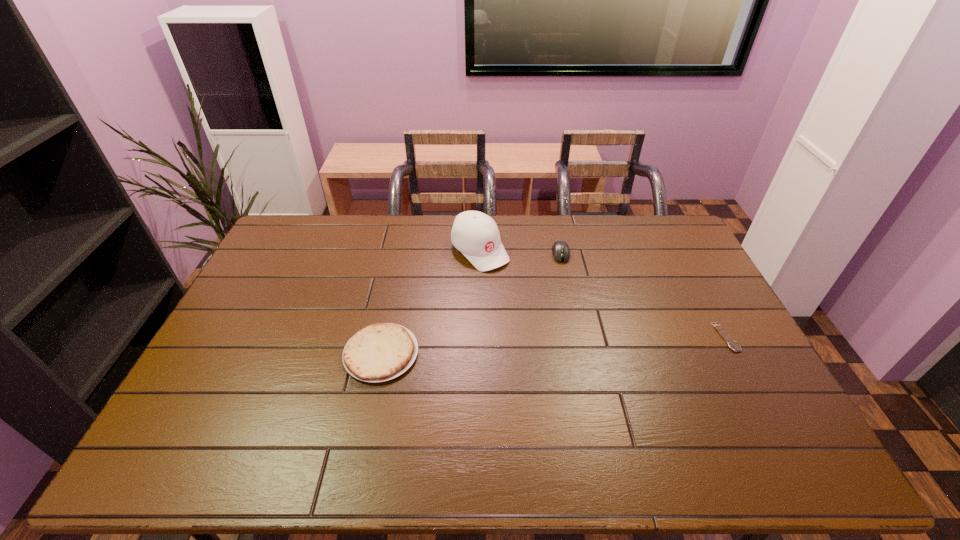
Where is `free space at the right edge of the desktop`? free space at the right edge of the desktop is located at coordinates (681, 291).

Where is `free region at the near right corner of the desktop`? free region at the near right corner of the desktop is located at coordinates (763, 397).

You are a GUI agent. You are given a task and a screenshot of the screen. Output one action in this format:
    pyautogui.click(x=<x>, y=<y>)
    Task: Click on the free space between the tortilla and the baseball cap
    
    Given the screenshot: What is the action you would take?
    pyautogui.click(x=430, y=302)

In order to click on empty space that is in between the computer mouse and the tortilla in this screenshot , I will do `click(471, 303)`.

Identify the location of unoccupied area between the second object from right to left and the tortilla. (471, 303).

Locate an element on the screen. Image resolution: width=960 pixels, height=540 pixels. unoccupied position between the tallest object and the third object from left to right is located at coordinates (520, 252).

At what (x,y) coordinates should I click in order to perform the action: click on unoccupied position between the leftmost object and the rightmost object. Please return your answer as a coordinate pair (x, y). The image size is (960, 540). Looking at the image, I should click on (554, 346).

Identify the location of vacant space that's between the tallest object and the leftmost object. (430, 302).

The image size is (960, 540). I want to click on vacant space that is in between the leftmost object and the baseball cap, so click(430, 302).

This screenshot has width=960, height=540. I want to click on free space that is in between the computer mouse and the leftmost object, so click(471, 303).